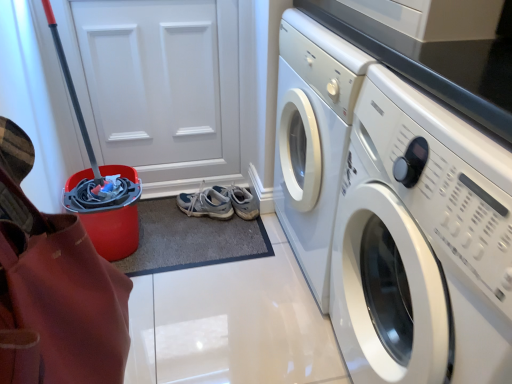
You are a GUI agent. You are given a task and a screenshot of the screen. Output one action in this format:
    pyautogui.click(x=<x>, y=<y>)
    Task: Click on the free spot in front of light gray fabric running shoe at center
    This screenshot has height=384, width=512.
    Given the screenshot: What is the action you would take?
    (208, 238)